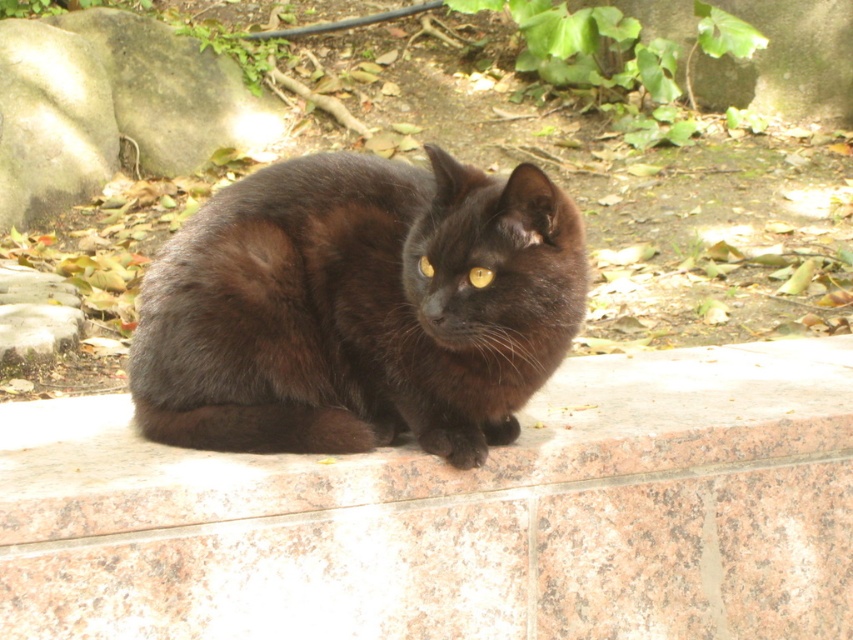
You are a photographer trying to capture a photo of the black cat. You need to ensure that both the green leafy plant at upper center and the yellow shiny eye at center are in focus. Given that your camera can only focus on objects within a 5 meter distance range, will both objects be in focus?

The green leafy plant at upper center and yellow shiny eye at center are 6.50 meters apart, so the distance between them exceeds the camera focus range of 5 meters. Therefore, both objects cannot be in focus simultaneously.